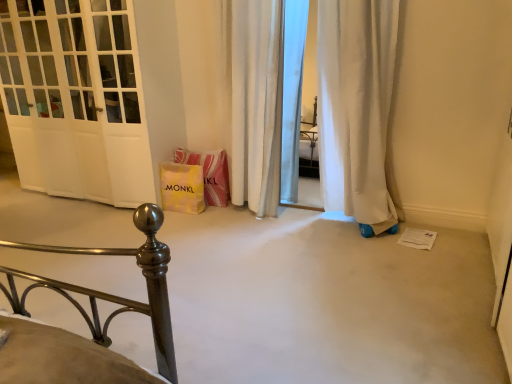
Question: From the image's perspective, relative to white glossy door at left, is yellow paper bag at lower center above or below?

Choices:
 (A) below
 (B) above

Answer: (A)

Question: In terms of height, does yellow paper bag at lower center look taller or shorter compared to white glossy door at left?

Choices:
 (A) tall
 (B) short

Answer: (B)

Question: Which is farther from the white fabric curtain at center?

Choices:
 (A) white glossy door at left
 (B) yellow paper bag at lower center
 (C) yellow paper bag at center

Answer: (A)

Question: Based on their relative distances, which object is farther from the yellow paper bag at center?

Choices:
 (A) yellow paper bag at lower center
 (B) white fabric curtain at center
 (C) white glossy door at left

Answer: (C)